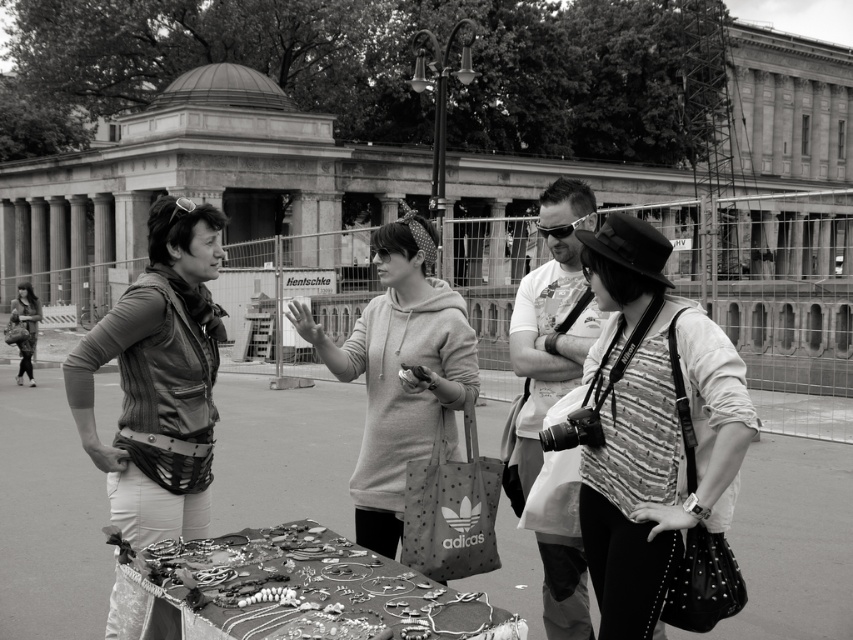
Which is more to the left, leather jacket at center or matte white t-shirt at center?

Positioned to the left is leather jacket at center.

Does leather jacket at center lie behind matte white t-shirt at center?

No, leather jacket at center is closer to the viewer.

Does point (161, 461) lie behind point (552, 198)?

No, it is not.

The width and height of the screenshot is (853, 640). What are the coordinates of `leather jacket at center` in the screenshot? It's located at (158, 380).

Which is more to the left, light gray hoodie at center or matte white t-shirt at center?

light gray hoodie at center

Can you confirm if light gray hoodie at center is positioned below matte white t-shirt at center?

Incorrect, light gray hoodie at center is not positioned below matte white t-shirt at center.

At what (x,y) coordinates should I click in order to perform the action: click on light gray hoodie at center. Please return your answer as a coordinate pair (x, y). The height and width of the screenshot is (640, 853). Looking at the image, I should click on (399, 372).

I want to click on light gray hoodie at center, so click(x=399, y=372).

Does light gray hoodie at center have a larger size compared to matte black jacket at left?

Actually, light gray hoodie at center might be smaller than matte black jacket at left.

Which is in front, point (399, 380) or point (22, 342)?

Point (399, 380)

You are a GUI agent. You are given a task and a screenshot of the screen. Output one action in this format:
    pyautogui.click(x=<x>, y=<y>)
    Task: Click on the light gray hoodie at center
    
    Given the screenshot: What is the action you would take?
    pyautogui.click(x=399, y=372)

At what (x,y) coordinates should I click in order to perform the action: click on light gray hoodie at center. Please return your answer as a coordinate pair (x, y). Looking at the image, I should click on (399, 372).